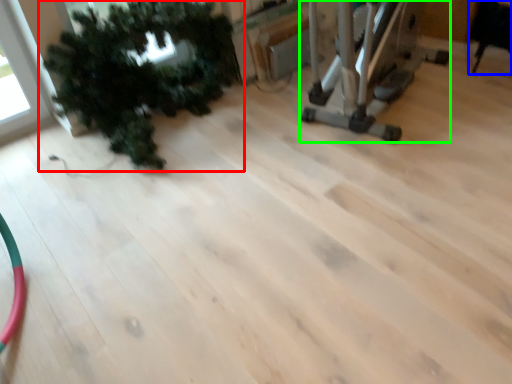
Question: Estimate the real-world distances between objects in this image. Which object is farther from houseplant (highlighted by a red box), chair (highlighted by a blue box) or equipment (highlighted by a green box)?

Choices:
 (A) chair
 (B) equipment

Answer: (A)